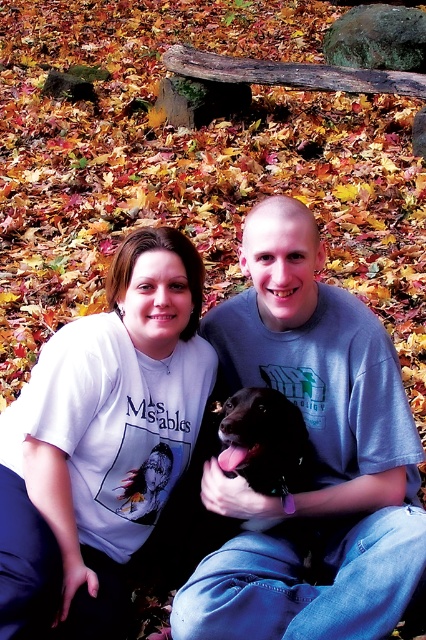
Question: Among these points, which one is farthest from the camera?

Choices:
 (A) (126, 436)
 (B) (216, 438)
 (C) (308, 493)

Answer: (B)

Question: Is white cotton shirt at center closer to the viewer compared to white matte t-shirt at center?

Choices:
 (A) no
 (B) yes

Answer: (A)

Question: Which point appears farthest from the camera in this image?

Choices:
 (A) tap(143, 560)
 (B) tap(88, 330)

Answer: (A)

Question: Which point is farther to the camera?

Choices:
 (A) white matte t-shirt at center
 (B) shiny black dog at center
 (C) white cotton shirt at center

Answer: (B)

Question: Does white cotton shirt at center lie behind shiny black dog at center?

Choices:
 (A) no
 (B) yes

Answer: (A)

Question: Is white matte t-shirt at center positioned behind shiny black dog at center?

Choices:
 (A) yes
 (B) no

Answer: (B)